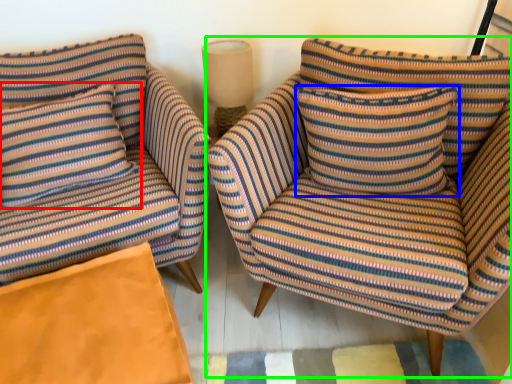
Question: Which is nearer to the pillow (highlighted by a red box)? pillow (highlighted by a blue box) or chair (highlighted by a green box).

Choices:
 (A) pillow
 (B) chair

Answer: (B)